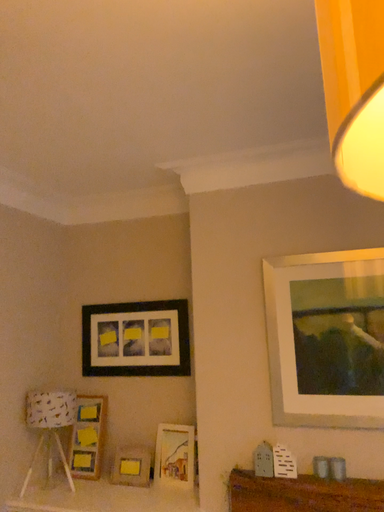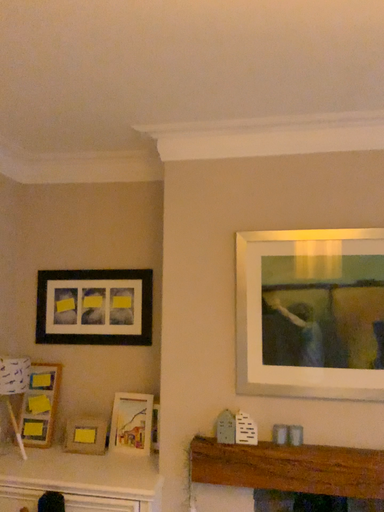
Question: How did the camera likely rotate when shooting the video?

Choices:
 (A) rotated right
 (B) rotated left

Answer: (A)